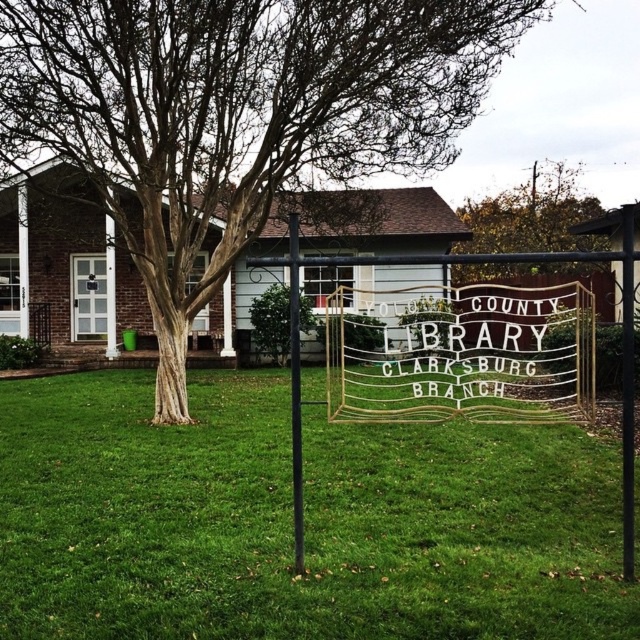
You are a maintenance worker who needs to water the green leafy tree at center. You have a hose that can reach 10 meters. Can you water the tree from the metallic pole at center without moving the hose? Please explain your reasoning.

The distance between the metallic pole at center and the green leafy tree at center is 11.64 meters. Since the hose can only reach 10 meters, it is not long enough to water the tree from the pole without moving the hose.

You are standing at the point marked as point [164,506] and want to reach the library entrance. The library entrance is located at the front door with a glass panel. Can you walk directly to the entrance without crossing any obstacles?

The distance between point [164,506] and the library entrance is 6.62 meters. Since there are no obstacles mentioned in the scene description, you can walk directly to the entrance.